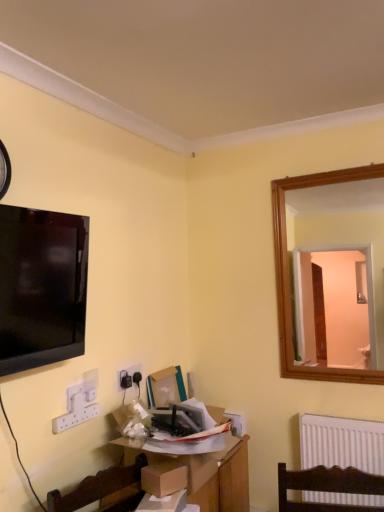
Question: Is black plastic clock at upper left outside of wooden table at center?

Choices:
 (A) yes
 (B) no

Answer: (A)

Question: Can you confirm if black plastic clock at upper left is taller than wooden table at center?

Choices:
 (A) yes
 (B) no

Answer: (A)

Question: From the image's perspective, does black plastic clock at upper left appear lower than wooden table at center?

Choices:
 (A) no
 (B) yes

Answer: (A)

Question: Can you confirm if black plastic clock at upper left is wider than wooden table at center?

Choices:
 (A) no
 (B) yes

Answer: (A)

Question: Considering the relative sizes of black plastic clock at upper left and wooden table at center in the image provided, is black plastic clock at upper left smaller than wooden table at center?

Choices:
 (A) yes
 (B) no

Answer: (A)

Question: Is cardboard box at center bigger or smaller than matte black tv at upper left?

Choices:
 (A) small
 (B) big

Answer: (A)

Question: In the image, is cardboard box at center positioned in front of or behind matte black tv at upper left?

Choices:
 (A) behind
 (B) front

Answer: (A)

Question: Considering the positions of cardboard box at center and matte black tv at upper left in the image, is cardboard box at center taller or shorter than matte black tv at upper left?

Choices:
 (A) short
 (B) tall

Answer: (A)

Question: Does point (163, 402) appear closer or farther from the camera than point (6, 371)?

Choices:
 (A) farther
 (B) closer

Answer: (A)

Question: Based on their sizes in the image, would you say white plastic electric outlet at lower left is bigger or smaller than matte black tv at upper left?

Choices:
 (A) small
 (B) big

Answer: (A)

Question: In terms of height, does white plastic electric outlet at lower left look taller or shorter compared to matte black tv at upper left?

Choices:
 (A) tall
 (B) short

Answer: (B)

Question: Is white plastic electric outlet at lower left inside or outside of matte black tv at upper left?

Choices:
 (A) outside
 (B) inside

Answer: (A)

Question: Relative to matte black tv at upper left, is white plastic electric outlet at lower left in front or behind?

Choices:
 (A) behind
 (B) front

Answer: (A)

Question: Considering the positions of white plastic electric outlet at lower left and black plastic clock at upper left in the image, is white plastic electric outlet at lower left wider or thinner than black plastic clock at upper left?

Choices:
 (A) thin
 (B) wide

Answer: (A)

Question: From a real-world perspective, relative to black plastic clock at upper left, is white plastic electric outlet at lower left vertically above or below?

Choices:
 (A) above
 (B) below

Answer: (B)